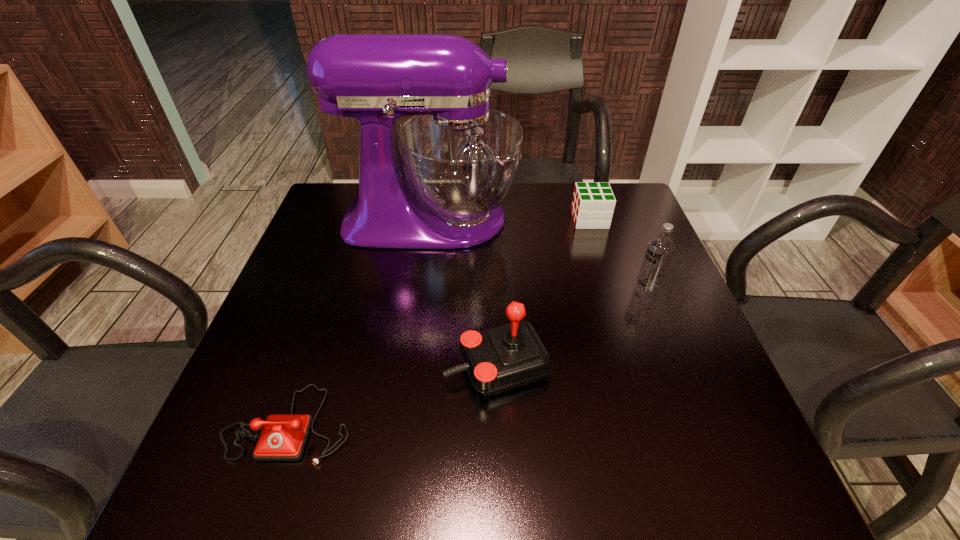
Find the location of a particular element. the tallest object is located at coordinates (460, 159).

Find the location of a particular element. the third nearest object is located at coordinates (660, 248).

The height and width of the screenshot is (540, 960). I want to click on the rightmost object, so click(660, 248).

The height and width of the screenshot is (540, 960). Find the location of `joystick`. joystick is located at coordinates (505, 357).

Locate an element on the screen. The width and height of the screenshot is (960, 540). the fourth object from left to right is located at coordinates (593, 204).

Locate an element on the screen. The image size is (960, 540). cube is located at coordinates (593, 204).

Locate an element on the screen. This screenshot has width=960, height=540. telephone is located at coordinates (283, 438).

Locate an element on the screen. blank space located at the bowl opening of the tallest object is located at coordinates (610, 219).

Image resolution: width=960 pixels, height=540 pixels. I want to click on free space located 0.070m on the front label of the rightmost object, so click(x=606, y=285).

Locate an element on the screen. This screenshot has height=540, width=960. vacant space located 0.240m on the front label of the rightmost object is located at coordinates (532, 285).